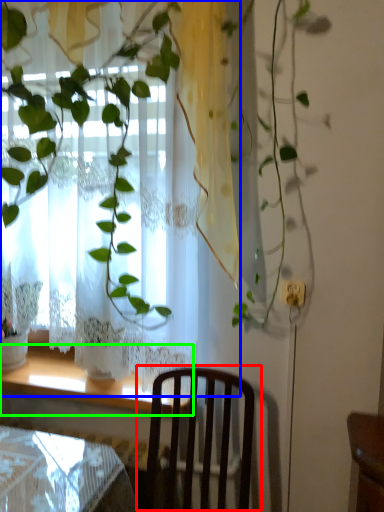
Question: Which object is positioned farthest from chair (highlighted by a red box)? Select from curtain (highlighted by a blue box) and window sill (highlighted by a green box).

Choices:
 (A) curtain
 (B) window sill

Answer: (A)